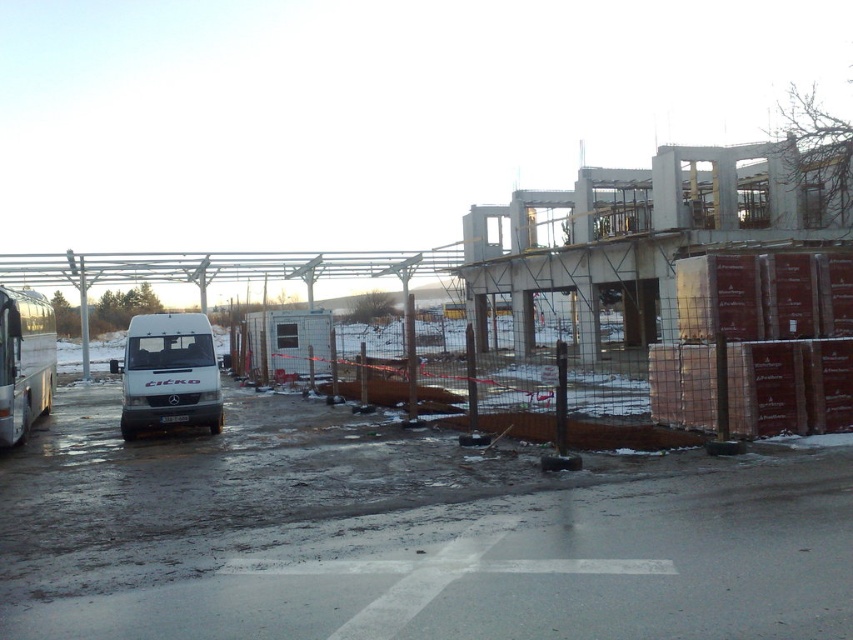
Between white matte van at left and silver metallic bus at left, which one is positioned lower?

white matte van at left

Between white matte van at left and silver metallic bus at left, which one has more height?

With more height is silver metallic bus at left.

This screenshot has height=640, width=853. What are the coordinates of `white matte van at left` in the screenshot? It's located at (167, 372).

The image size is (853, 640). I want to click on white matte van at left, so click(167, 372).